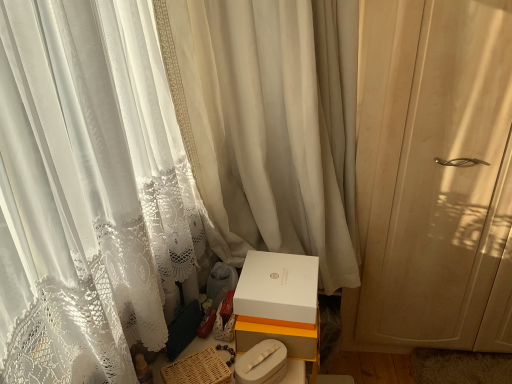
Question: Does woven brown basket at lower center lie in front of white sheer curtain at center, positioned as the 2th curtain in right-to-left order?

Choices:
 (A) yes
 (B) no

Answer: (B)

Question: Is white sheer curtain at center, which appears as the first curtain when viewed from the left, at the back of woven brown basket at lower center?

Choices:
 (A) no
 (B) yes

Answer: (A)

Question: Can you confirm if woven brown basket at lower center is wider than white sheer curtain at center, positioned as the 2th curtain in right-to-left order?

Choices:
 (A) no
 (B) yes

Answer: (A)

Question: Is white sheer curtain at center, positioned as the 2th curtain in right-to-left order, surrounded by woven brown basket at lower center?

Choices:
 (A) yes
 (B) no

Answer: (B)

Question: Considering the relative positions of woven brown basket at lower center and white sheer curtain at center, positioned as the 2th curtain in right-to-left order, in the image provided, is woven brown basket at lower center behind white sheer curtain at center, positioned as the 2th curtain in right-to-left order,?

Choices:
 (A) yes
 (B) no

Answer: (A)

Question: From the image's perspective, relative to white matte box at lower center, the first box in the top-to-bottom sequence, is white lace curtain at right, which ranks as the 2th curtain in left-to-right order, above or below?

Choices:
 (A) below
 (B) above

Answer: (B)

Question: Is white lace curtain at right, which ranks as the 2th curtain in left-to-right order, wider or thinner than white matte box at lower center, the second box when ordered from bottom to top?

Choices:
 (A) wide
 (B) thin

Answer: (B)

Question: Is white lace curtain at right, arranged as the 1th curtain when viewed from the right, to the left or to the right of white matte box at lower center, the first box in the top-to-bottom sequence, in the image?

Choices:
 (A) left
 (B) right

Answer: (B)

Question: From a real-world perspective, is white lace curtain at right, arranged as the 1th curtain when viewed from the right, positioned above or below white matte box at lower center, the first box in the top-to-bottom sequence?

Choices:
 (A) below
 (B) above

Answer: (B)

Question: Considering the positions of woven brown basket at lower center and white matte box at center, arranged as the 1th box when ordered from the bottom, in the image, is woven brown basket at lower center taller or shorter than white matte box at center, arranged as the 1th box when ordered from the bottom,?

Choices:
 (A) tall
 (B) short

Answer: (B)

Question: Is woven brown basket at lower center inside the boundaries of white matte box at center, arranged as the 1th box when ordered from the bottom, or outside?

Choices:
 (A) outside
 (B) inside

Answer: (A)

Question: Looking at the image, does woven brown basket at lower center seem bigger or smaller compared to white matte box at center, arranged as the 1th box when ordered from the bottom?

Choices:
 (A) small
 (B) big

Answer: (B)

Question: From the image's perspective, is woven brown basket at lower center located above or below white matte box at center, arranged as the 1th box when ordered from the bottom?

Choices:
 (A) above
 (B) below

Answer: (B)

Question: Is woven brown basket at lower center inside the boundaries of white lace curtain at right, which ranks as the 2th curtain in left-to-right order, or outside?

Choices:
 (A) inside
 (B) outside

Answer: (B)

Question: Is woven brown basket at lower center taller or shorter than white lace curtain at right, arranged as the 1th curtain when viewed from the right?

Choices:
 (A) short
 (B) tall

Answer: (A)